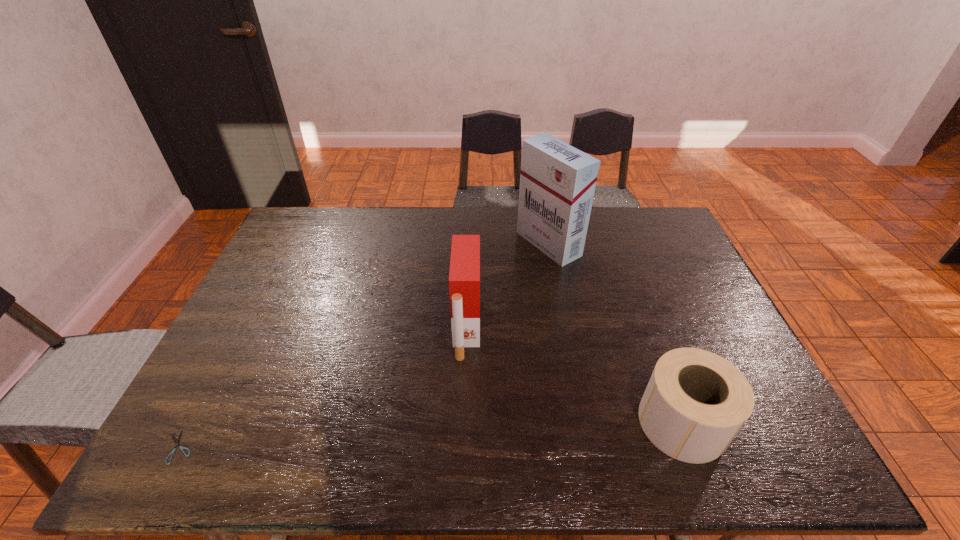
In the image, there is a desktop. Where is `blank space at the near edge`? This screenshot has width=960, height=540. blank space at the near edge is located at coordinates (634, 434).

Where is `blank space at the right edge of the desktop`? blank space at the right edge of the desktop is located at coordinates (676, 284).

Locate an element on the screen. The width and height of the screenshot is (960, 540). free spot at the far left corner of the desktop is located at coordinates (297, 213).

Find the location of a particular element. This screenshot has width=960, height=540. vacant space at the far right corner of the desktop is located at coordinates (660, 224).

Locate an element on the screen. This screenshot has width=960, height=540. vacant space at the near right corner of the desktop is located at coordinates (740, 448).

This screenshot has width=960, height=540. In order to click on free space between the shears and the toilet tissue in this screenshot , I will do [x=431, y=435].

Locate an element on the screen. The height and width of the screenshot is (540, 960). empty space between the nearer cigarette case and the shears is located at coordinates (323, 388).

At what (x,y) coordinates should I click in order to perform the action: click on vacant region between the leftmost object and the rightmost object. Please return your answer as a coordinate pair (x, y). Image resolution: width=960 pixels, height=540 pixels. Looking at the image, I should click on [431, 435].

Find the location of a particular element. vacant point located between the shears and the right cigarette case is located at coordinates (364, 346).

Where is `free space that is in between the taller cigarette case and the shortest object`? The height and width of the screenshot is (540, 960). free space that is in between the taller cigarette case and the shortest object is located at coordinates (364, 346).